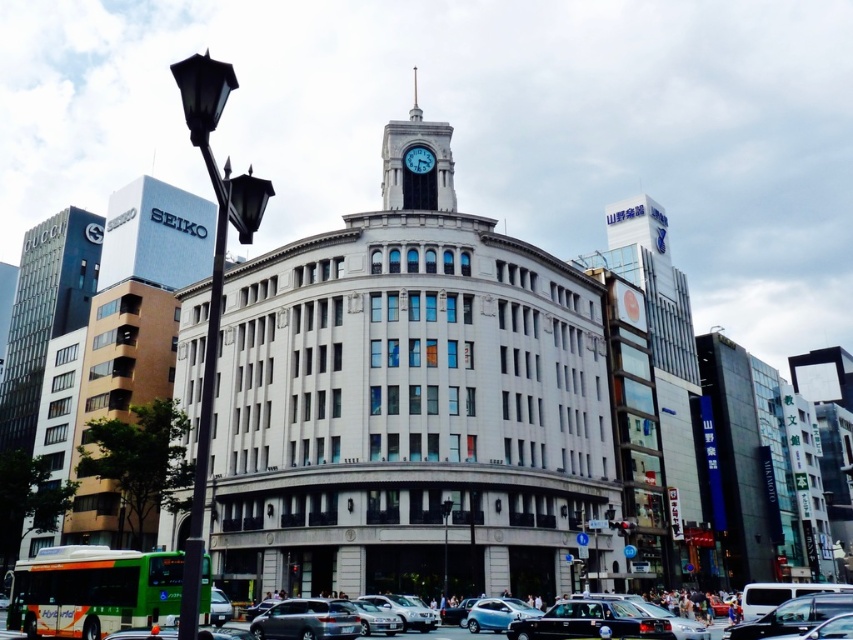
Question: In this image, where is metallic silver car at center located relative to metallic silver sedan at center?

Choices:
 (A) right
 (B) left

Answer: (A)

Question: Which of the following is the closest to the observer?

Choices:
 (A) (488, 465)
 (B) (410, 154)
 (C) (804, 609)

Answer: (C)

Question: Is white stone clock tower at upper center thinner than metallic silver car at center?

Choices:
 (A) yes
 (B) no

Answer: (B)

Question: Is silver metallic van at center bigger than metallic silver car at center?

Choices:
 (A) yes
 (B) no

Answer: (A)

Question: Which object is farther from the camera taking this photo?

Choices:
 (A) silver metallic van at center
 (B) metallic silver sedan at center
 (C) white stone clock tower at center
 (D) white glossy clock at upper center

Answer: (D)

Question: Among these objects, which one is farthest from the camera?

Choices:
 (A) metallic silver sedan at center
 (B) metallic silver car at center
 (C) white glossy clock at upper center

Answer: (C)